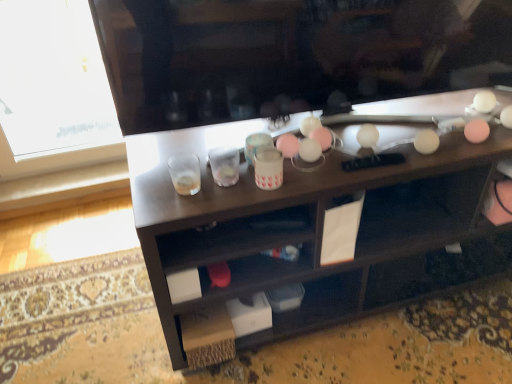
You are a GUI agent. You are given a task and a screenshot of the screen. Output one action in this format:
    pyautogui.click(x=<x>, y=<y>)
    Task: Click on the free space in front of clear plastic shot glass at center, which is counted as the 2th shot glass, starting from the left
    The width and height of the screenshot is (512, 384).
    Given the screenshot: What is the action you would take?
    pyautogui.click(x=218, y=200)